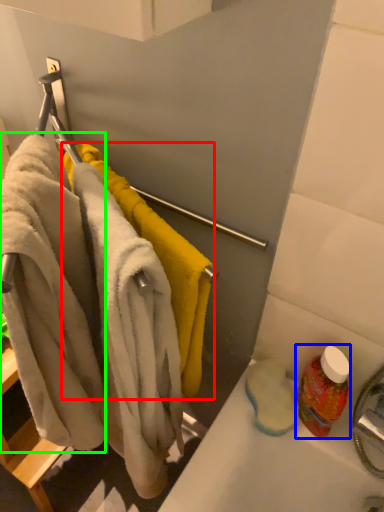
Question: Estimate the real-world distances between objects in this image. Which object is farther from towel (highlighted by a red box), cleaning product (highlighted by a blue box) or bath towel (highlighted by a green box)?

Choices:
 (A) cleaning product
 (B) bath towel

Answer: (A)